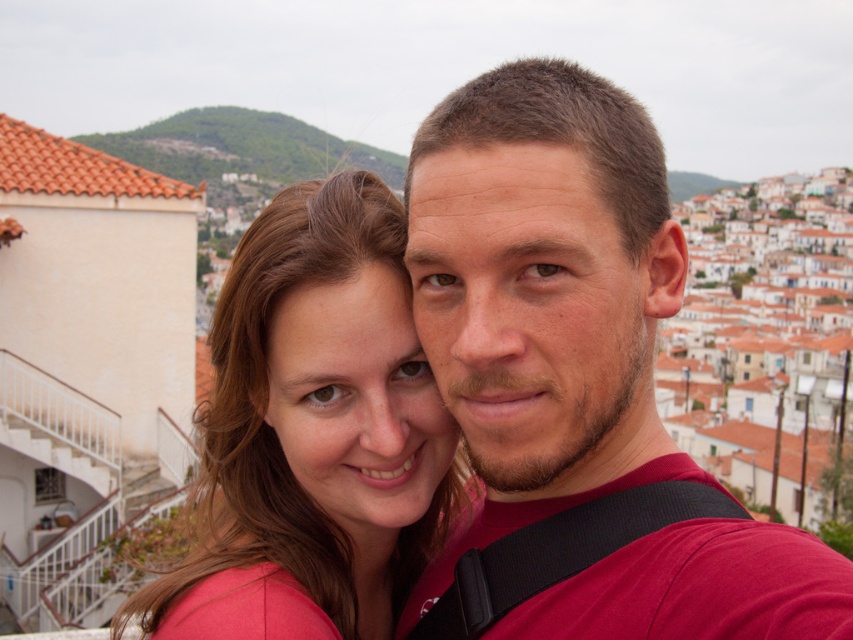
Question: Can you confirm if matte red shirt at center is wider than matte pink shirt at center?

Choices:
 (A) yes
 (B) no

Answer: (B)

Question: Does matte red shirt at center come behind matte pink shirt at center?

Choices:
 (A) yes
 (B) no

Answer: (B)

Question: Which point is closer to the camera?

Choices:
 (A) pos(457,376)
 (B) pos(224,296)

Answer: (A)

Question: Which object is farther from the camera taking this photo?

Choices:
 (A) matte pink shirt at center
 (B) matte red shirt at center

Answer: (A)

Question: Is matte red shirt at center wider than matte pink shirt at center?

Choices:
 (A) no
 (B) yes

Answer: (A)